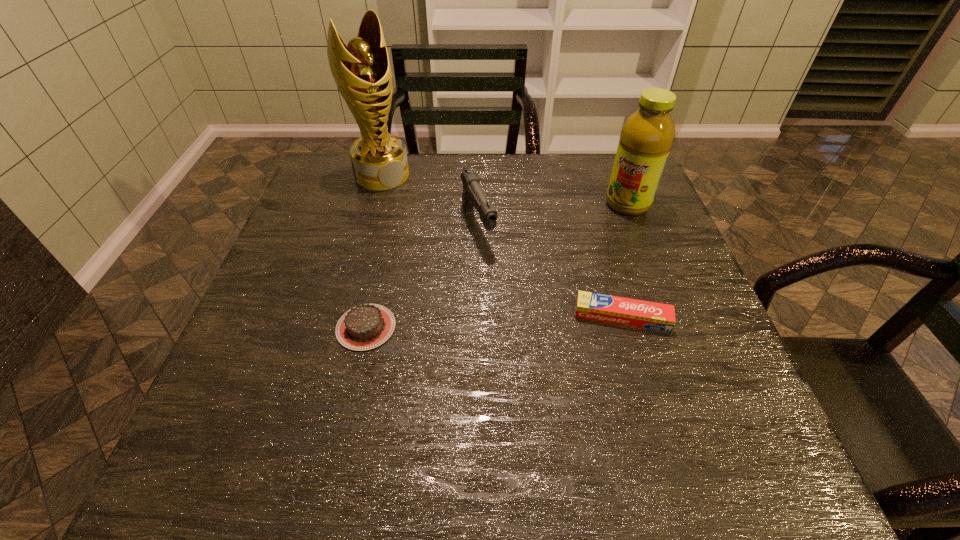
Find the location of a particular element. The width and height of the screenshot is (960, 540). empty space that is in between the gun and the tallest object is located at coordinates (430, 201).

Where is `vacant point located between the toothpaste and the award`? vacant point located between the toothpaste and the award is located at coordinates (502, 246).

You are a GUI agent. You are given a task and a screenshot of the screen. Output one action in this format:
    pyautogui.click(x=<x>, y=<y>)
    Task: Click on the vacant space that's between the toothpaste and the gun
    The height and width of the screenshot is (540, 960).
    Given the screenshot: What is the action you would take?
    pyautogui.click(x=550, y=272)

This screenshot has width=960, height=540. What are the coordinates of `free spot between the toothpaste and the chocolate cake` in the screenshot? It's located at (494, 322).

At what (x,y) coordinates should I click in order to perform the action: click on vacant area that lies between the fourth shortest object and the tallest object. Please return your answer as a coordinate pair (x, y). Looking at the image, I should click on (505, 190).

Locate an element on the screen. The image size is (960, 540). unoccupied position between the tallest object and the third object from left to right is located at coordinates (430, 201).

I want to click on free space between the fruit juice and the award, so click(505, 190).

The height and width of the screenshot is (540, 960). I want to click on vacant region between the toothpaste and the third shortest object, so click(x=550, y=272).

You are a GUI agent. You are given a task and a screenshot of the screen. Output one action in this format:
    pyautogui.click(x=<x>, y=<y>)
    Task: Click on the free spot between the chocolate cake and the toothpaste
    
    Given the screenshot: What is the action you would take?
    pyautogui.click(x=494, y=322)

The image size is (960, 540). Identify the location of free space between the chocolate cake and the toothpaste. (494, 322).